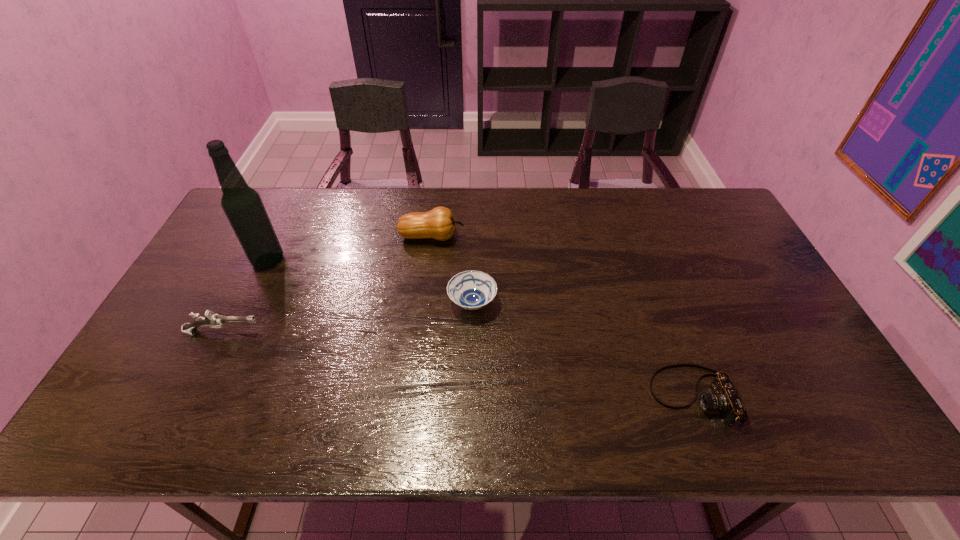
Locate an element on the screen. free space located on the stem side of the farthest object is located at coordinates click(x=482, y=237).

Locate an element on the screen. free space located aimed along the barrel of the gun is located at coordinates coord(284,332).

Image resolution: width=960 pixels, height=540 pixels. Identify the location of blank area located 0.260m on the back of the soup bowl. (473, 228).

Locate an element on the screen. vacant space located 0.190m on the front-facing side of the rightmost object is located at coordinates (571, 396).

Find the location of `free space located on the front-facing side of the rightmost object`. free space located on the front-facing side of the rightmost object is located at coordinates (516, 396).

At what (x,y) coordinates should I click in order to perform the action: click on vacant space located 0.120m on the front-facing side of the rightmost object. Please return your answer as a coordinate pair (x, y). The image size is (960, 540). Looking at the image, I should click on (601, 396).

Find the location of a particular element. The height and width of the screenshot is (540, 960). object at the far edge is located at coordinates (438, 223).

Find the location of a particular element. The height and width of the screenshot is (540, 960). object that is positioned at the near edge is located at coordinates (724, 397).

What are the coordinates of `alcohol that is at the left edge` in the screenshot? It's located at (243, 206).

At what (x,y) coordinates should I click in order to perform the action: click on gun positioned at the left edge. Please return your answer as a coordinate pair (x, y). This screenshot has width=960, height=540. Looking at the image, I should click on (212, 320).